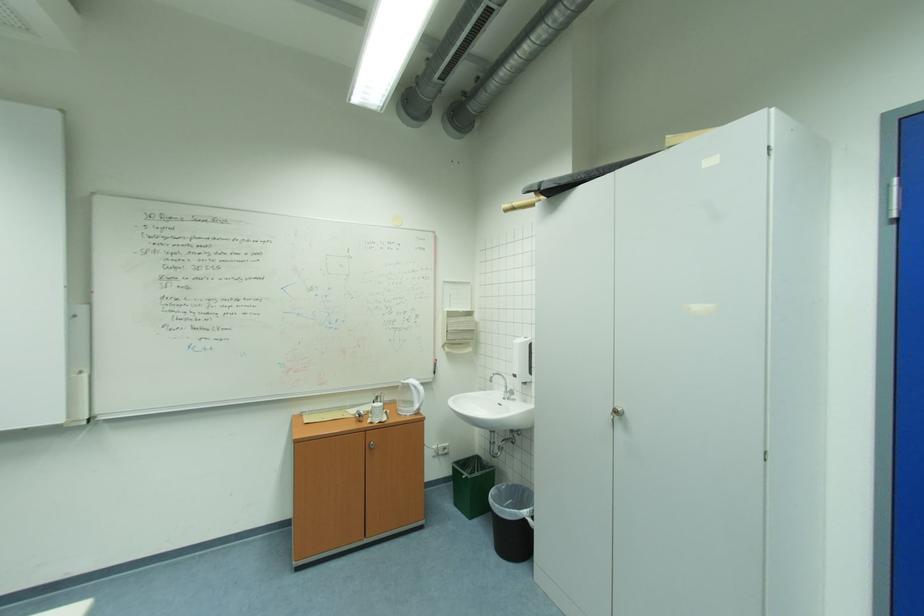
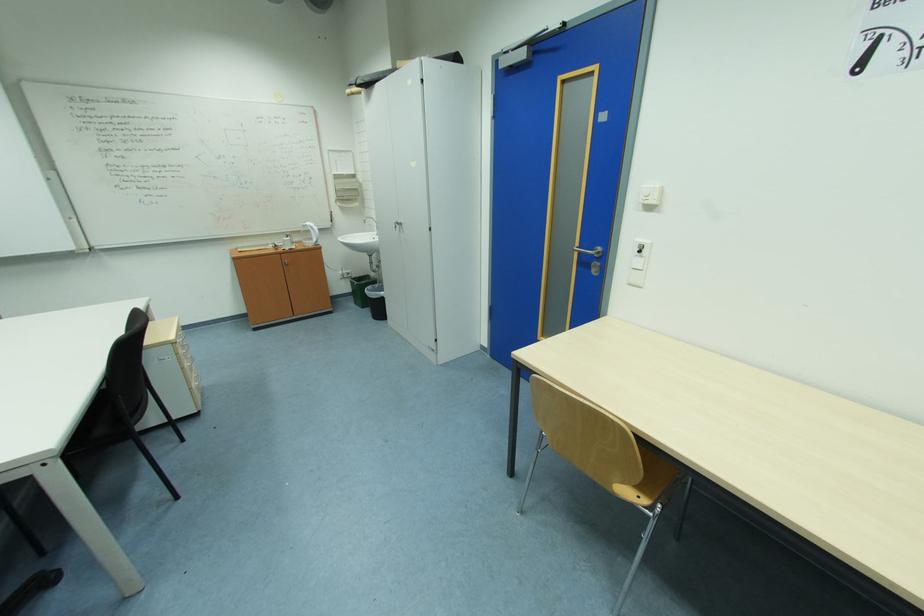
The point at (464, 505) is marked in the first image. Where is the corresponding point in the second image?

(362, 304)